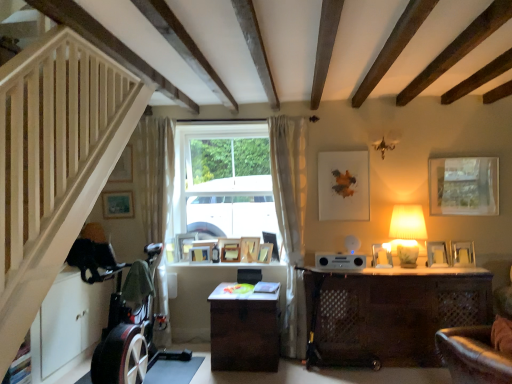
Question: Is the position of matte gold picture frame at upper left, placed as the tenth picture frame when sorted from right to left, more distant than that of wooden photo frame at center, the 6th picture frame viewed from the left?

Choices:
 (A) yes
 (B) no

Answer: (B)

Question: Is matte gold picture frame at upper left, positioned as the first picture frame in left-to-right order, turned away from wooden photo frame at center, the fifth picture frame in the right-to-left sequence?

Choices:
 (A) yes
 (B) no

Answer: (B)

Question: Is wooden photo frame at center, the fifth picture frame in the right-to-left sequence, located within matte gold picture frame at upper left, positioned as the first picture frame in left-to-right order?

Choices:
 (A) yes
 (B) no

Answer: (B)

Question: Is matte gold picture frame at upper left, placed as the tenth picture frame when sorted from right to left, at the right side of wooden photo frame at center, the fifth picture frame in the right-to-left sequence?

Choices:
 (A) yes
 (B) no

Answer: (B)

Question: From a real-world perspective, is matte gold picture frame at upper left, placed as the tenth picture frame when sorted from right to left, over wooden photo frame at center, the 6th picture frame viewed from the left?

Choices:
 (A) yes
 (B) no

Answer: (A)

Question: Is matte gold picture frame at upper left, positioned as the first picture frame in left-to-right order, aimed at wooden photo frame at center, the 6th picture frame viewed from the left?

Choices:
 (A) yes
 (B) no

Answer: (B)

Question: Can you confirm if white sheer curtain at left, which is counted as the 2th curtain, starting from the right, is positioned to the right of metallic reflective picture frame at right, which is counted as the first picture frame, starting from the right?

Choices:
 (A) no
 (B) yes

Answer: (A)

Question: Is white sheer curtain at left, the 1th curtain viewed from the left, further to camera compared to metallic reflective picture frame at right, which is counted as the first picture frame, starting from the right?

Choices:
 (A) no
 (B) yes

Answer: (B)

Question: Are white sheer curtain at left, the 1th curtain viewed from the left, and metallic reflective picture frame at right, which is counted as the first picture frame, starting from the right, making contact?

Choices:
 (A) no
 (B) yes

Answer: (A)

Question: From a real-world perspective, does white sheer curtain at left, the 1th curtain viewed from the left, stand above metallic reflective picture frame at right, which is counted as the first picture frame, starting from the right?

Choices:
 (A) yes
 (B) no

Answer: (A)

Question: Would you say white sheer curtain at left, which is counted as the 2th curtain, starting from the right, is a long distance from metallic reflective picture frame at right, positioned as the 10th picture frame in left-to-right order?

Choices:
 (A) yes
 (B) no

Answer: (A)

Question: Is white sheer curtain at left, the 1th curtain viewed from the left, completely or partially outside of metallic reflective picture frame at right, which is counted as the first picture frame, starting from the right?

Choices:
 (A) yes
 (B) no

Answer: (A)

Question: Is matte silver picture frame at right, the 3th picture frame in the right-to-left sequence, located outside silver metallic picture frame at right, positioned as the 9th picture frame in left-to-right order?

Choices:
 (A) no
 (B) yes

Answer: (B)